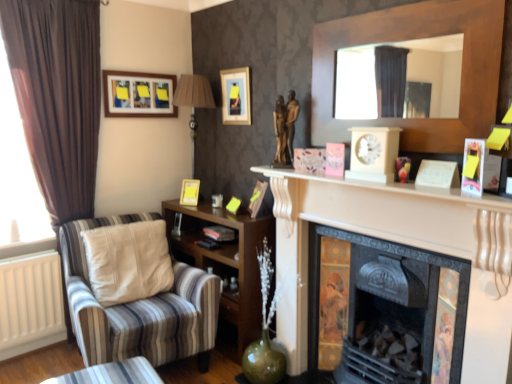
Question: Is brown fabric curtain at left to the right of matte wooden picture frame at upper left, which ranks as the 3th picture frame in right-to-left order, from the viewer's perspective?

Choices:
 (A) no
 (B) yes

Answer: (A)

Question: Does brown fabric curtain at left have a greater height compared to matte wooden picture frame at upper left, the 1th picture frame in the left-to-right sequence?

Choices:
 (A) no
 (B) yes

Answer: (B)

Question: From a real-world perspective, is brown fabric curtain at left on top of matte wooden picture frame at upper left, the 1th picture frame in the left-to-right sequence?

Choices:
 (A) no
 (B) yes

Answer: (A)

Question: Does brown fabric curtain at left have a lesser width compared to matte wooden picture frame at upper left, which ranks as the 3th picture frame in right-to-left order?

Choices:
 (A) no
 (B) yes

Answer: (A)

Question: Does brown fabric curtain at left lie in front of matte wooden picture frame at upper left, the 1th picture frame when ordered from top to bottom?

Choices:
 (A) no
 (B) yes

Answer: (B)

Question: Is white glossy fireplace at center, placed as the second fireplace when sorted from right to left, inside the boundaries of matte gold picture frame at center, which ranks as the 3th picture frame in top-to-bottom order, or outside?

Choices:
 (A) outside
 (B) inside

Answer: (A)

Question: From a real-world perspective, is white glossy fireplace at center, placed as the first fireplace when sorted from left to right, above or below matte gold picture frame at center, the second picture frame viewed from the left?

Choices:
 (A) above
 (B) below

Answer: (B)

Question: Looking at their shapes, would you say white glossy fireplace at center, placed as the second fireplace when sorted from right to left, is wider or thinner than matte gold picture frame at center, arranged as the 2th picture frame when viewed from the right?

Choices:
 (A) thin
 (B) wide

Answer: (B)

Question: Is point (286, 276) positioned closer to the camera than point (181, 203)?

Choices:
 (A) farther
 (B) closer

Answer: (B)

Question: Considering the positions of bronze statue at center and wooden shelf at lower left in the image, is bronze statue at center taller or shorter than wooden shelf at lower left?

Choices:
 (A) short
 (B) tall

Answer: (A)

Question: From the image's perspective, is bronze statue at center located above or below wooden shelf at lower left?

Choices:
 (A) below
 (B) above

Answer: (B)

Question: In terms of size, does bronze statue at center appear bigger or smaller than wooden shelf at lower left?

Choices:
 (A) small
 (B) big

Answer: (A)

Question: Is bronze statue at center wider or thinner than wooden shelf at lower left?

Choices:
 (A) wide
 (B) thin

Answer: (B)

Question: Is point (192, 144) positioned closer to the camera than point (90, 72)?

Choices:
 (A) closer
 (B) farther

Answer: (B)

Question: Is metallic silver lamp at upper center situated inside brown fabric curtain at left or outside?

Choices:
 (A) inside
 (B) outside

Answer: (B)